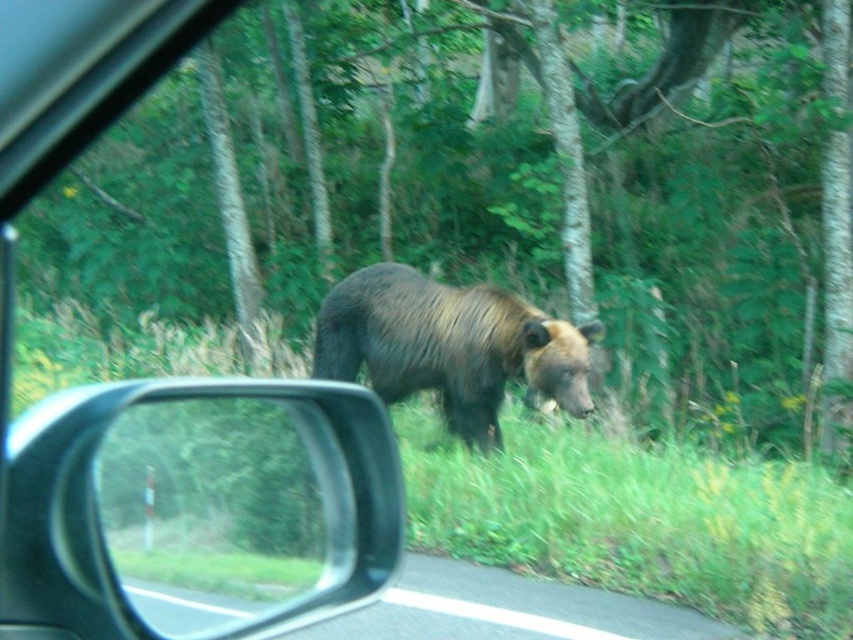
You are a driver approaching the scene shown in the image. You see the green leafy tree at center and the brown furry bear at center. Which object is wider from your perspective?

The green leafy tree at center is wider than the brown furry bear at center.

From the picture: You are driving a car and notice the clear plastic side mirror at lower left and the brown furry bear at center. Which object is taller when viewed from your perspective inside the car?

The brown furry bear at center is taller than the clear plastic side mirror at lower left.